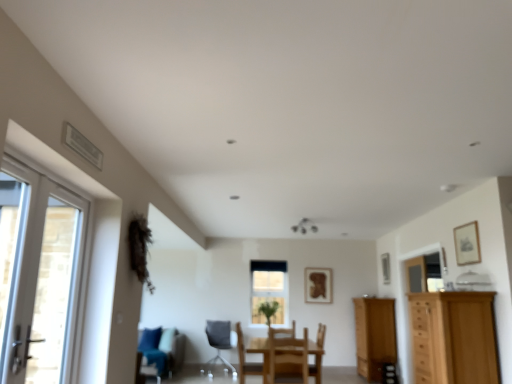
Question: Can you confirm if clear glass window at center is positioned to the left of wooden framed picture at center, the 3th picture frame from the front?

Choices:
 (A) yes
 (B) no

Answer: (A)

Question: Is wooden framed picture at center, the 3th picture frame positioned from the top, completely or partially inside clear glass window at center?

Choices:
 (A) no
 (B) yes

Answer: (A)

Question: Is clear glass window at center facing away from wooden framed picture at center, the 3th picture frame viewed from the right?

Choices:
 (A) no
 (B) yes

Answer: (A)

Question: Does clear glass window at center lie behind wooden framed picture at center, the 3th picture frame positioned from the top?

Choices:
 (A) no
 (B) yes

Answer: (B)

Question: Can you confirm if clear glass window at center is taller than wooden framed picture at center, the 3th picture frame viewed from the right?

Choices:
 (A) no
 (B) yes

Answer: (B)

Question: Is wooden chair at center, the first chair viewed from the front, to the left or to the right of wooden chair at center, which is the 2th chair from front to back, in the image?

Choices:
 (A) left
 (B) right

Answer: (B)

Question: From the image's perspective, is wooden chair at center, the 3th chair when ordered from left to right, positioned above or below wooden chair at center, which is the 2th chair from front to back?

Choices:
 (A) above
 (B) below

Answer: (A)

Question: In terms of width, does wooden chair at center, the 3th chair when ordered from left to right, look wider or thinner when compared to wooden chair at center, the second chair when ordered from left to right?

Choices:
 (A) thin
 (B) wide

Answer: (B)

Question: In terms of height, does wooden chair at center, the first chair viewed from the front, look taller or shorter compared to wooden chair at center, which is the 2th chair from front to back?

Choices:
 (A) short
 (B) tall

Answer: (A)

Question: Is white glossy door at left, arranged as the first door when viewed from the top, situated inside wooden framed picture at center, the 3th picture frame positioned from the top, or outside?

Choices:
 (A) inside
 (B) outside

Answer: (B)

Question: Looking at their shapes, would you say white glossy door at left, marked as the 1th door in a left-to-right arrangement, is wider or thinner than wooden framed picture at center, the 3th picture frame from the front?

Choices:
 (A) thin
 (B) wide

Answer: (B)

Question: From their relative heights in the image, would you say white glossy door at left, arranged as the first door when viewed from the top, is taller or shorter than wooden framed picture at center, the 3th picture frame positioned from the top?

Choices:
 (A) short
 (B) tall

Answer: (B)

Question: From the image's perspective, is white glossy door at left, marked as the 1th door in a left-to-right arrangement, positioned above or below wooden framed picture at center, the 3th picture frame positioned from the top?

Choices:
 (A) below
 (B) above

Answer: (B)

Question: In terms of size, does clear glass window at center appear bigger or smaller than green leafy plant at center?

Choices:
 (A) small
 (B) big

Answer: (A)

Question: Is clear glass window at center in front of or behind green leafy plant at center in the image?

Choices:
 (A) front
 (B) behind

Answer: (B)